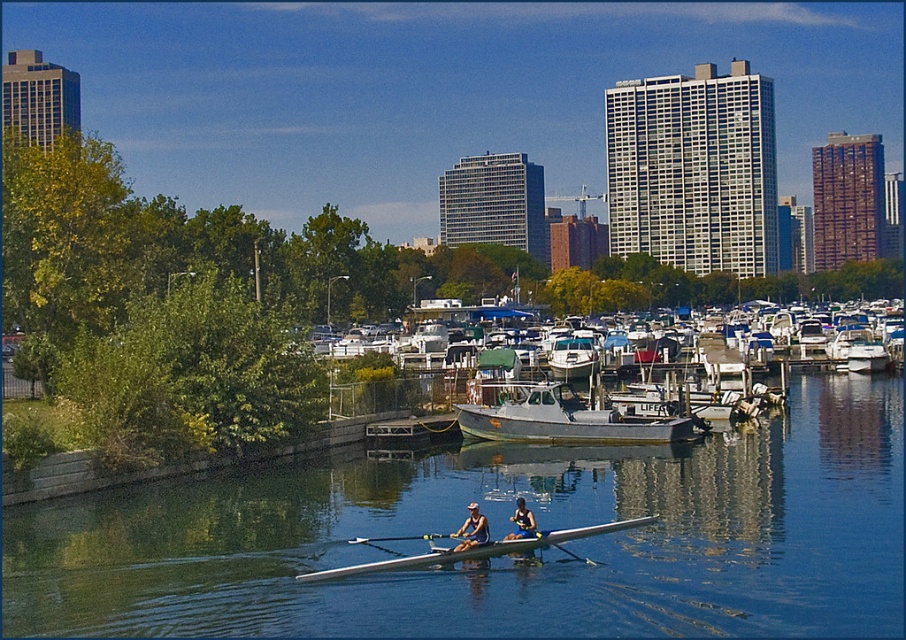
Which is in front, point (484, 524) or point (407, 536)?

Point (484, 524) is more forward.

Is matte blue rower at center thinner than white plastic paddle at center?

Incorrect, matte blue rower at center's width is not less than white plastic paddle at center's.

The width and height of the screenshot is (906, 640). Find the location of `matte blue rower at center`. matte blue rower at center is located at coordinates (471, 529).

Image resolution: width=906 pixels, height=640 pixels. I want to click on matte blue rower at center, so click(471, 529).

Does point (391, 570) come closer to viewer compared to point (373, 540)?

Yes.

How distant is silver metallic canoe at center from white plastic paddle at center?

2.07 meters

Is point (543, 532) farther from camera compared to point (361, 540)?

No, it is in front of (361, 540).

Where is `silver metallic canoe at center`? silver metallic canoe at center is located at coordinates (468, 548).

Is metallic gray boat at center to the right of silver metallic canoe at center from the viewer's perspective?

Correct, you'll find metallic gray boat at center to the right of silver metallic canoe at center.

Who is shorter, metallic gray boat at center or silver metallic canoe at center?

With less height is silver metallic canoe at center.

Which is behind, point (598, 440) or point (326, 577)?

The point (598, 440) is more distant.

In order to click on metallic gray boat at center in this screenshot , I will do `click(564, 420)`.